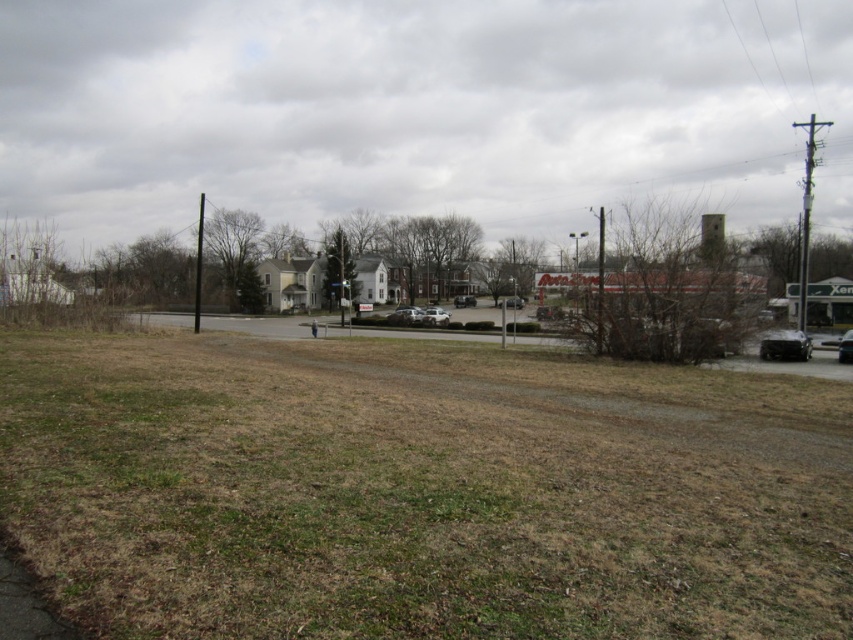
You are a delivery driver who needs to park your white matte van at center in a spot that is exactly 70 meters away from the camera. Based on the scene, can you safely park there without exceeding the required distance?

The white matte van at center is currently 70.70 meters from the camera, which is slightly over the 70 meters requirement. Therefore, you cannot safely park there without exceeding the required distance.